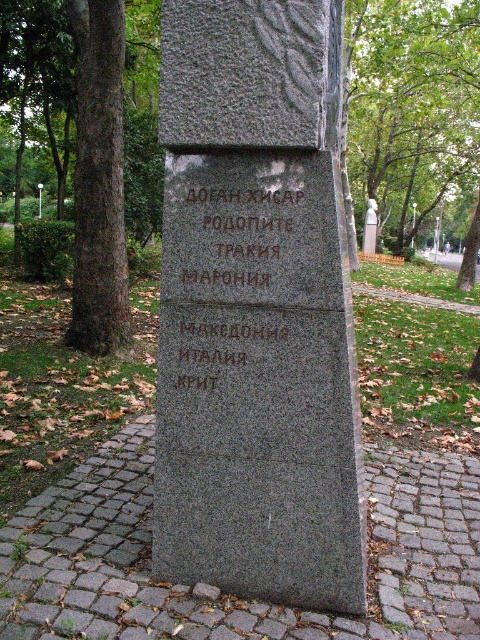
Does point (240, 380) lie behind point (175, 291)?

No, it is in front of (175, 291).

Is granite stone monument at center smaller than black granite stone at center?

Incorrect, granite stone monument at center is not smaller in size than black granite stone at center.

Between point (228, 147) and point (253, 230), which one is positioned in front?

Positioned in front is point (228, 147).

Find the location of a particular element. The image size is (480, 640). granite stone monument at center is located at coordinates click(256, 308).

Image resolution: width=480 pixels, height=640 pixels. What are the coordinates of `black granite stone at center` in the screenshot? It's located at (235, 246).

Does point (186, 276) lie in front of point (369, 227)?

Yes, point (186, 276) is closer to viewer.

Which is in front, point (224, 212) or point (367, 250)?

Point (224, 212)

Identify the location of black granite stone at center. (235, 246).

The width and height of the screenshot is (480, 640). What are the coordinates of `green leafy tree at upper center` in the screenshot? It's located at 410,100.

Consider the image. Which is more to the right, green leafy tree at upper center or sanded stone statue at center?

Positioned to the right is green leafy tree at upper center.

Is point (478, 1) farther from camera compared to point (371, 204)?

No, it is in front of (371, 204).

I want to click on green leafy tree at upper center, so click(410, 100).